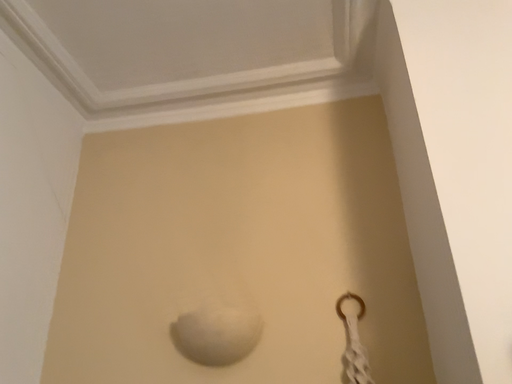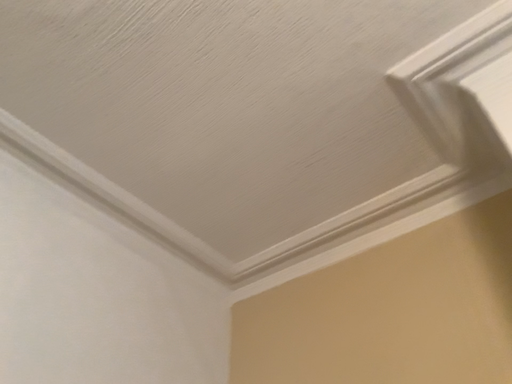
Question: Which way did the camera rotate in the video?

Choices:
 (A) rotated upward
 (B) rotated downward

Answer: (A)